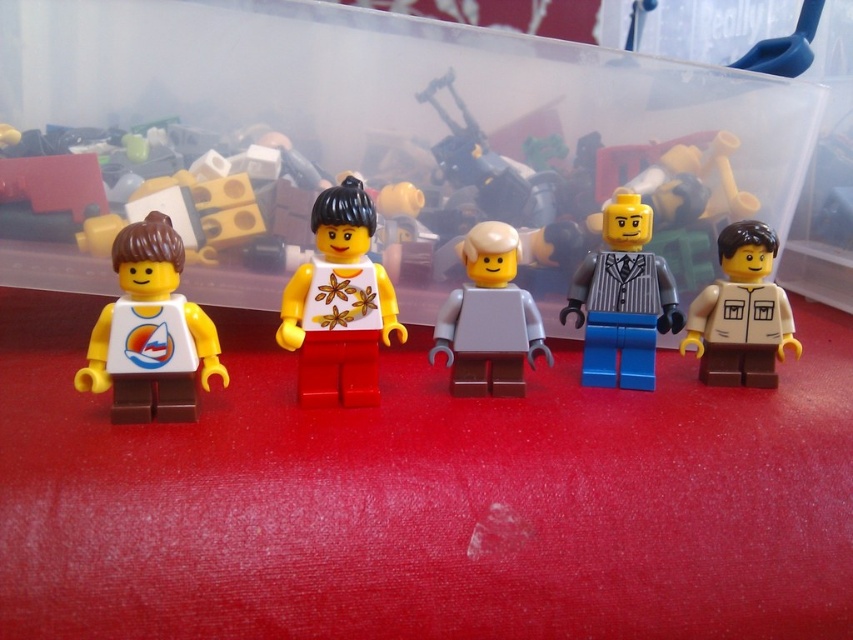
Question: Observing the image, what is the correct spatial positioning of matte white shirt at left in reference to matte gray striped shirt at center?

Choices:
 (A) right
 (B) left

Answer: (B)

Question: Can you confirm if matte white shirt at left is wider than matte gray striped shirt at center?

Choices:
 (A) no
 (B) yes

Answer: (A)

Question: Estimate the real-world distances between objects in this image. Which object is closer to the light gray matte minifigure at center?

Choices:
 (A) tan matte shirt at right
 (B) matte gray striped shirt at center

Answer: (B)

Question: Which of these objects is positioned closest to the matte gray striped shirt at center?

Choices:
 (A) matte white shirt at center
 (B) light gray matte minifigure at center
 (C) tan matte shirt at right
 (D) matte white shirt at left

Answer: (C)

Question: Among these points, which one is farthest from the camera?

Choices:
 (A) (708, 358)
 (B) (625, 342)

Answer: (A)

Question: Does matte white shirt at left have a greater width compared to matte gray striped shirt at center?

Choices:
 (A) no
 (B) yes

Answer: (A)